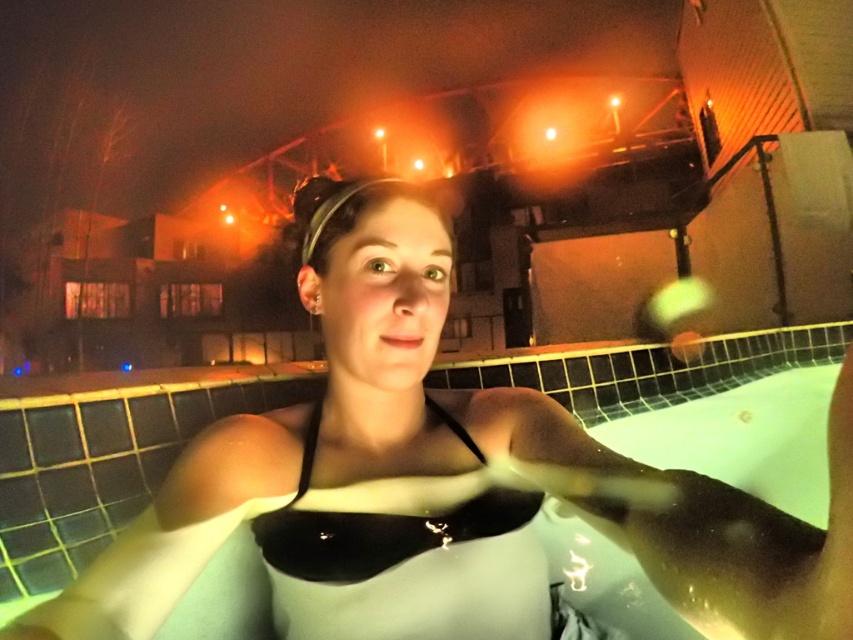
Which is below, white matte swimsuit at center or black matte bikini top at center?

white matte swimsuit at center

Is white matte swimsuit at center to the left of black matte bikini top at center from the viewer's perspective?

No, white matte swimsuit at center is not to the left of black matte bikini top at center.

The width and height of the screenshot is (853, 640). I want to click on white matte swimsuit at center, so click(x=450, y=477).